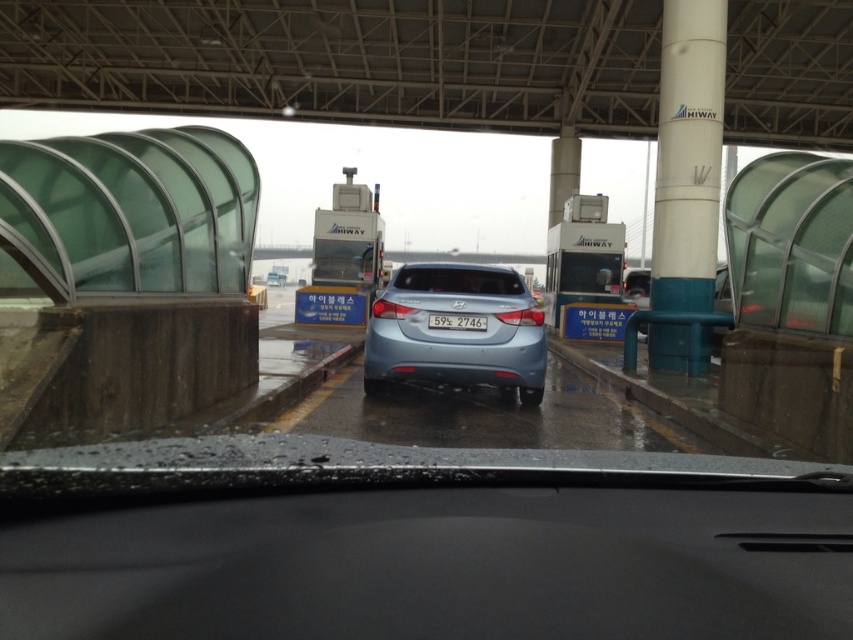
Question: Considering the relative positions of white glossy pole at upper right and white plastic license plate at center in the image provided, where is white glossy pole at upper right located with respect to white plastic license plate at center?

Choices:
 (A) left
 (B) right

Answer: (B)

Question: Which of the following is the closest to the observer?

Choices:
 (A) white plastic license plate at center
 (B) satin blue sedan at center
 (C) semi-glossy blue car at center
 (D) white glossy pole at upper right

Answer: (B)

Question: Which point is closer to the camera taking this photo?

Choices:
 (A) (709, 196)
 (B) (438, 268)
 (C) (509, 349)
 (D) (471, 323)

Answer: (C)

Question: Is white glossy pole at upper right to the right of satin blue sedan at center from the viewer's perspective?

Choices:
 (A) yes
 (B) no

Answer: (A)

Question: Observing the image, what is the correct spatial positioning of satin blue sedan at center in reference to white plastic license plate at center?

Choices:
 (A) below
 (B) above

Answer: (A)

Question: Among these points, which one is farthest from the camera?

Choices:
 (A) (519, 285)
 (B) (688, 17)

Answer: (B)